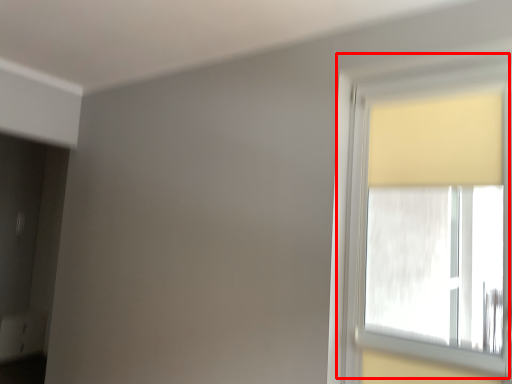
Question: From the image's perspective, what is the correct spatial relationship of window (annotated by the red box) in relation to curtain?

Choices:
 (A) above
 (B) below

Answer: (B)